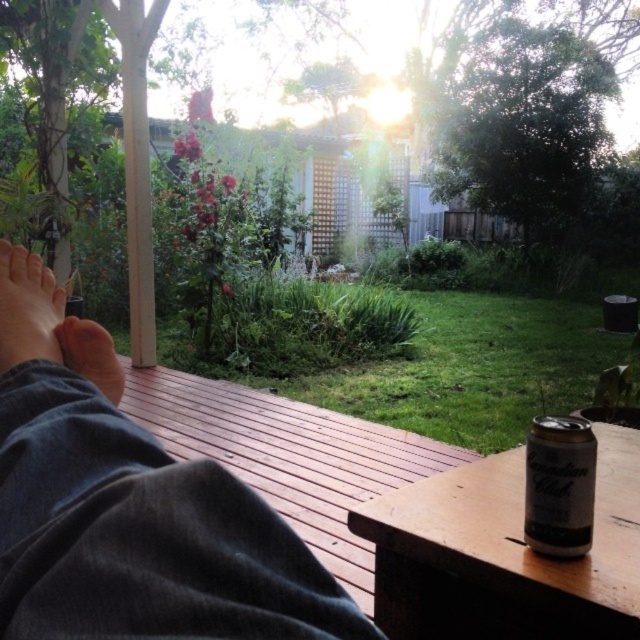
Question: Which is farther from the silver metallic can at lower right?

Choices:
 (A) smooth skin foot at lower left
 (B) wooden table at lower right

Answer: (A)

Question: Estimate the real-world distances between objects in this image. Which object is closer to the smooth skin foot at lower left?

Choices:
 (A) silver metallic can at lower right
 (B) brown suede foot at lower left

Answer: (B)

Question: Can you confirm if dark gray fabric at lower left is bigger than smooth skin foot at lower left?

Choices:
 (A) yes
 (B) no

Answer: (A)

Question: Estimate the real-world distances between objects in this image. Which object is closer to the brown suede foot at lower left?

Choices:
 (A) smooth skin foot at lower left
 (B) dark gray fabric at lower left
 (C) wooden table at lower right

Answer: (A)

Question: Considering the relative positions of dark gray fabric at lower left and smooth skin foot at lower left in the image provided, where is dark gray fabric at lower left located with respect to smooth skin foot at lower left?

Choices:
 (A) below
 (B) above

Answer: (A)

Question: Is dark gray fabric at lower left below brown suede foot at lower left?

Choices:
 (A) no
 (B) yes

Answer: (B)